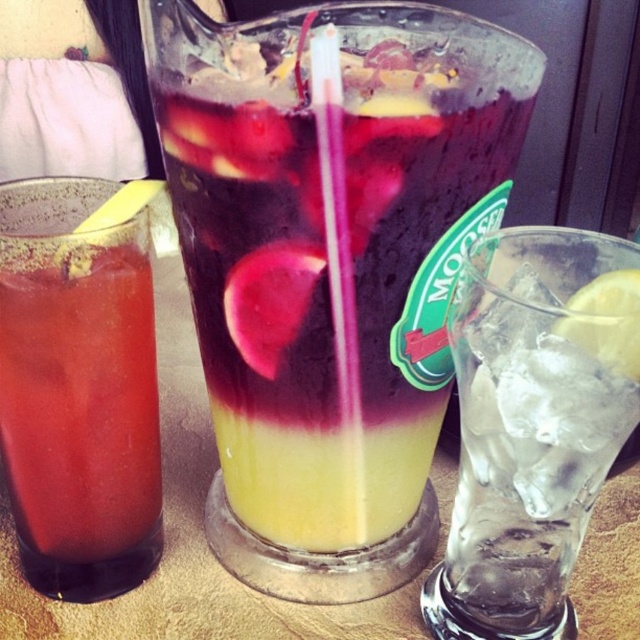
Is transparent plastic straw at center taller than yellow matte lemon at right?

Yes.

What do you see at coordinates (339, 260) in the screenshot?
I see `transparent plastic straw at center` at bounding box center [339, 260].

This screenshot has width=640, height=640. What are the coordinates of `transparent plastic straw at center` in the screenshot? It's located at (339, 260).

Measure the distance from translucent glass at center to clear glass ice at center.

translucent glass at center is 1.66 inches from clear glass ice at center.

Does point (173, 177) come behind point (611, 371)?

Yes, it is.

The image size is (640, 640). Describe the element at coordinates (326, 266) in the screenshot. I see `translucent glass at center` at that location.

In order to click on translucent glass at center in this screenshot , I will do `click(326, 266)`.

Is translucent glass at center shorter than transparent plastic straw at center?

No, translucent glass at center is not shorter than transparent plastic straw at center.

Between translucent glass at center and transparent plastic straw at center, which one has less height?

transparent plastic straw at center

Is point (388, 548) closer to viewer compared to point (320, 84)?

That is False.

At what (x,y) coordinates should I click in order to perform the action: click on translucent glass at center. Please return your answer as a coordinate pair (x, y). The height and width of the screenshot is (640, 640). Looking at the image, I should click on (326, 266).